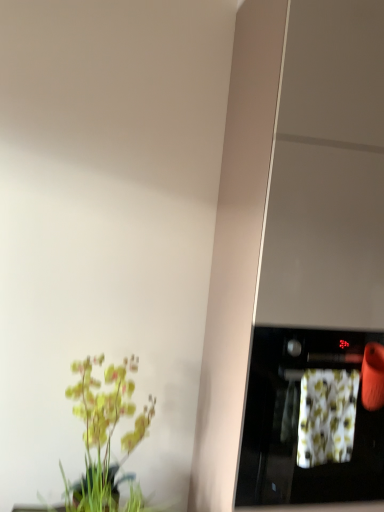
Question: Considering the relative sizes of black glossy oven at right and floral fabric at right in the image provided, is black glossy oven at right thinner than floral fabric at right?

Choices:
 (A) yes
 (B) no

Answer: (B)

Question: Is black glossy oven at right touching floral fabric at right?

Choices:
 (A) no
 (B) yes

Answer: (B)

Question: From a real-world perspective, does black glossy oven at right stand above floral fabric at right?

Choices:
 (A) yes
 (B) no

Answer: (B)

Question: Are black glossy oven at right and floral fabric at right located far from each other?

Choices:
 (A) no
 (B) yes

Answer: (A)

Question: Does black glossy oven at right appear on the left side of floral fabric at right?

Choices:
 (A) no
 (B) yes

Answer: (B)

Question: From a real-world perspective, is black glossy oven at right physically below floral fabric at right?

Choices:
 (A) no
 (B) yes

Answer: (B)

Question: From the image's perspective, is floral fabric at right below green matte plant at lower left?

Choices:
 (A) no
 (B) yes

Answer: (A)

Question: From a real-world perspective, is floral fabric at right located higher than green matte plant at lower left?

Choices:
 (A) yes
 (B) no

Answer: (A)

Question: Is floral fabric at right shorter than green matte plant at lower left?

Choices:
 (A) yes
 (B) no

Answer: (A)

Question: Is floral fabric at right directly adjacent to green matte plant at lower left?

Choices:
 (A) yes
 (B) no

Answer: (B)

Question: Is floral fabric at right positioned in front of green matte plant at lower left?

Choices:
 (A) no
 (B) yes

Answer: (B)

Question: Is the depth of floral fabric at right greater than that of green matte plant at lower left?

Choices:
 (A) yes
 (B) no

Answer: (B)

Question: From the image's perspective, is floral fabric at right over black glossy oven at right?

Choices:
 (A) no
 (B) yes

Answer: (B)